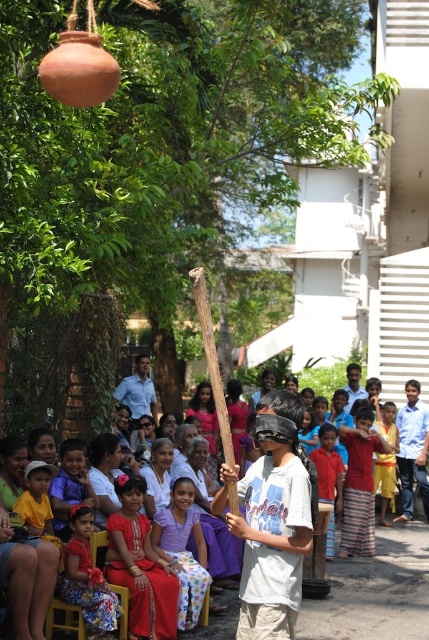
Consider the image. Does matte purple dress at lower left have a lesser height compared to red cotton dress at center?

Indeed, matte purple dress at lower left has a lesser height compared to red cotton dress at center.

Can you confirm if matte purple dress at lower left is smaller than red cotton dress at center?

→ Yes.

Find the location of a particular element. The width and height of the screenshot is (429, 640). matte purple dress at lower left is located at coordinates (69, 484).

This screenshot has height=640, width=429. Describe the element at coordinates (386, 460) in the screenshot. I see `red cotton dress at center` at that location.

At what (x,y) coordinates should I click in order to perform the action: click on red cotton dress at center. Please return your answer as a coordinate pair (x, y). Looking at the image, I should click on (386, 460).

Looking at this image, does red striped skirt at center come behind red cotton dress at center?

No, red striped skirt at center is in front of red cotton dress at center.

Is red striped skirt at center bigger than red cotton dress at center?

Yes.

Does point (362, 499) come in front of point (377, 420)?

Yes.

Where is `red striped skirt at center`? red striped skirt at center is located at coordinates (359, 484).